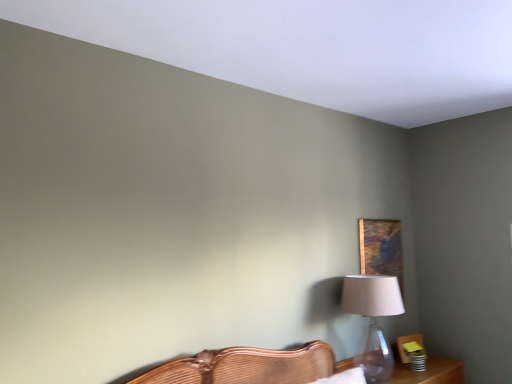
Question: Is wooden table at lower right far from wooden painting at upper right?

Choices:
 (A) no
 (B) yes

Answer: (A)

Question: Is the depth of wooden table at lower right less than that of wooden painting at upper right?

Choices:
 (A) no
 (B) yes

Answer: (B)

Question: Can you confirm if wooden table at lower right is positioned to the left of wooden painting at upper right?

Choices:
 (A) no
 (B) yes

Answer: (A)

Question: Is wooden table at lower right positioned beyond the bounds of wooden painting at upper right?

Choices:
 (A) no
 (B) yes

Answer: (B)

Question: Considering the relative sizes of wooden table at lower right and wooden painting at upper right in the image provided, is wooden table at lower right bigger than wooden painting at upper right?

Choices:
 (A) yes
 (B) no

Answer: (A)

Question: Is point (374, 240) closer or farther from the camera than point (454, 377)?

Choices:
 (A) closer
 (B) farther

Answer: (B)

Question: In the image, is wooden painting at upper right on the left side or the right side of wooden table at lower right?

Choices:
 (A) right
 (B) left

Answer: (B)

Question: Based on their sizes in the image, would you say wooden painting at upper right is bigger or smaller than wooden table at lower right?

Choices:
 (A) small
 (B) big

Answer: (A)

Question: Do you think wooden painting at upper right is within wooden table at lower right, or outside of it?

Choices:
 (A) outside
 (B) inside

Answer: (A)

Question: From a real-world perspective, is translucent glass table lamp at right positioned above or below wooden table at lower right?

Choices:
 (A) below
 (B) above

Answer: (B)

Question: Do you think translucent glass table lamp at right is within wooden table at lower right, or outside of it?

Choices:
 (A) outside
 (B) inside

Answer: (A)

Question: Relative to wooden table at lower right, is translucent glass table lamp at right in front or behind?

Choices:
 (A) front
 (B) behind

Answer: (A)

Question: In terms of width, does translucent glass table lamp at right look wider or thinner when compared to wooden table at lower right?

Choices:
 (A) wide
 (B) thin

Answer: (B)

Question: Based on their sizes in the image, would you say wooden table at lower right is bigger or smaller than translucent glass table lamp at right?

Choices:
 (A) small
 (B) big

Answer: (B)

Question: Is point (441, 380) positioned closer to the camera than point (369, 292)?

Choices:
 (A) farther
 (B) closer

Answer: (A)